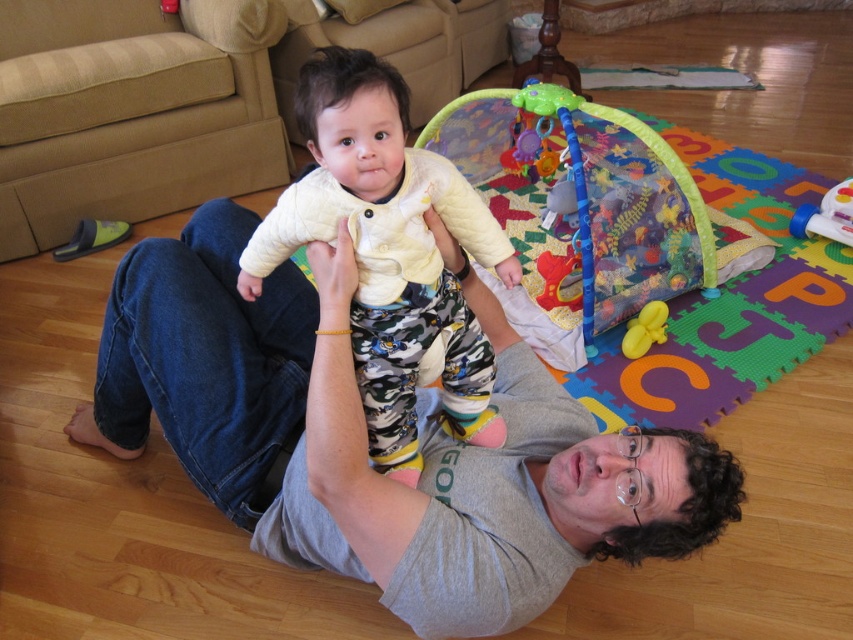
Based on the scene described, which object is taller between the gray cotton shirt at center and the quilted yellow jacket at center?

The gray cotton shirt at center is much taller than the quilted yellow jacket at center.

You are a parent trying to place a toy for your baby to reach. The baby is currently standing on the man lying on the floor. The multicolored foam mat at center and the translucent plastic toy at upper right are in the scene. Which object is closer to the baby?

The multicolored foam mat at center is closer to the baby since it is only 51.49 centimeters away from the translucent plastic toy at upper right, but the baby is on the man who is on the floor where the foam mat is at center. Therefore, the foam mat is directly under the baby, making it closer than the toy which is further away at upper right.